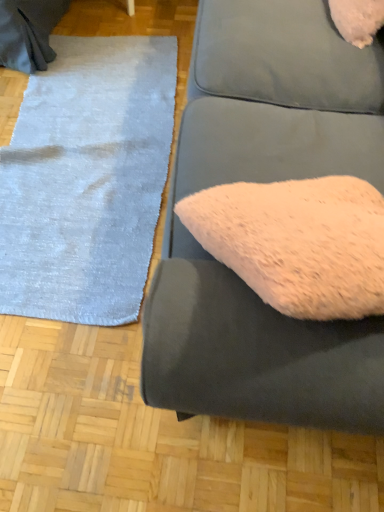
At what (x,y) coordinates should I click in order to perform the action: click on vacant space situated above light blue plush rug at left (from a real-world perspective). Please return your answer as a coordinate pair (x, y). Looking at the image, I should click on (85, 144).